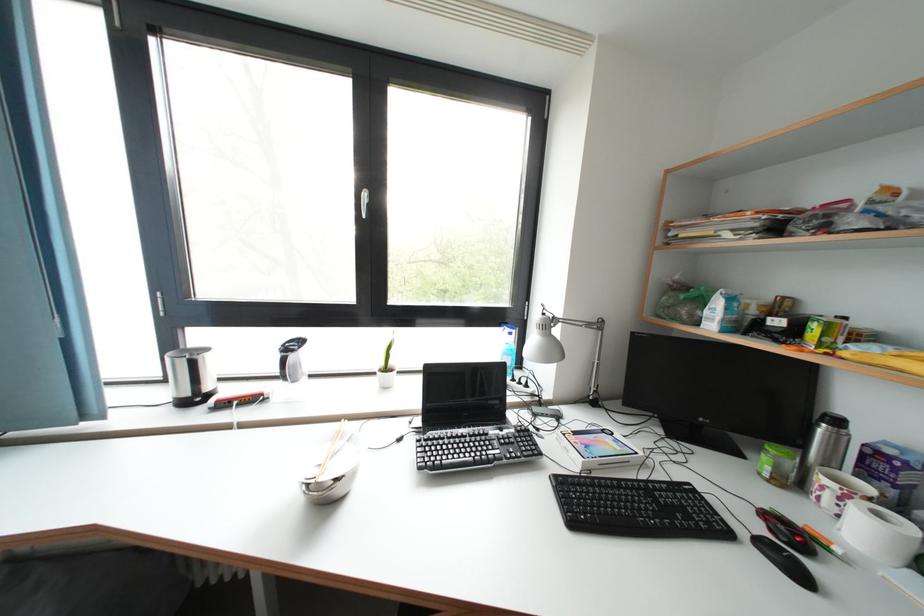
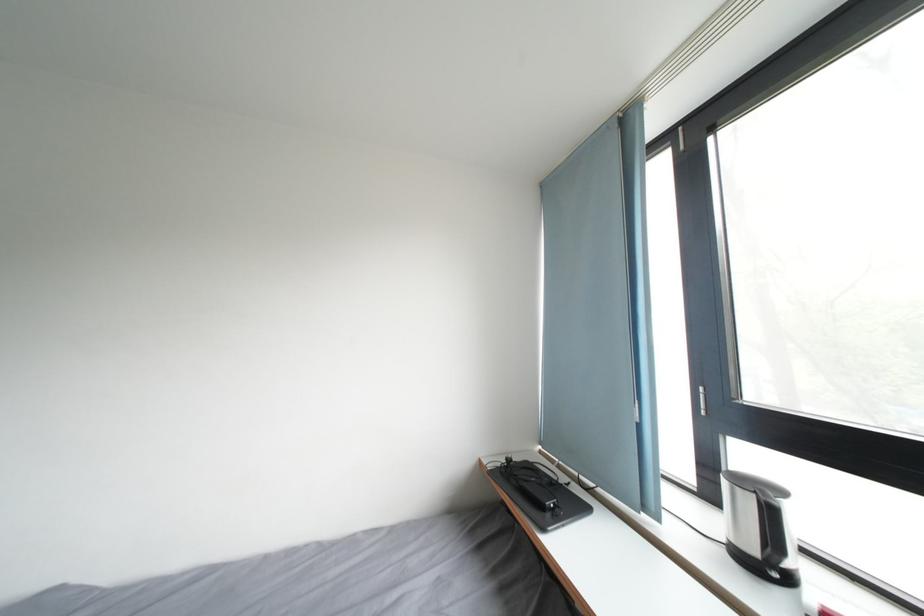
Where in the second image is the point corresponding to the point at 93,422 from the first image?

(651, 514)